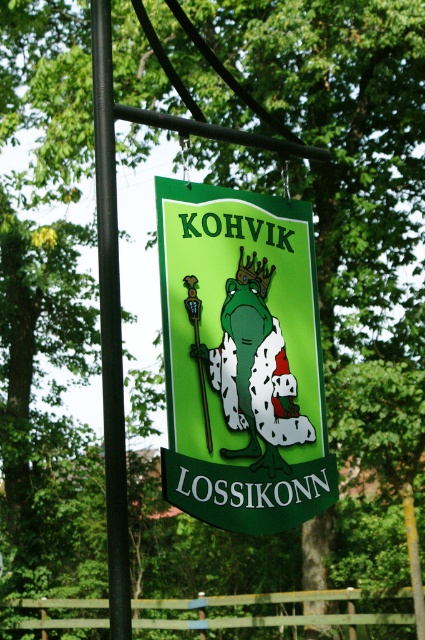
You are an artist trying to sketch the scene. The green matte sign at center and the black metal pole at left are both in your view. Which object should you draw first if you want to capture the larger one first?

The green matte sign at center is bigger than the black metal pole at left, so you should draw the green matte sign at center first.

You are a painter who needs to know the relative sizes of the objects in the scene to plan your painting. Which object is shorter between the green matte sign at center and the black metal pole at left?

The green matte sign at center is not as tall as the black metal pole at left, so the green matte sign at center is shorter.

You are standing in front of the signboard and want to place two markers at the coordinates point (x=178, y=483) and point (x=108, y=515). Which marker will be closer to the viewer?

Point (x=108, y=515) is closer to the viewer because it is in front of point (x=178, y=483).